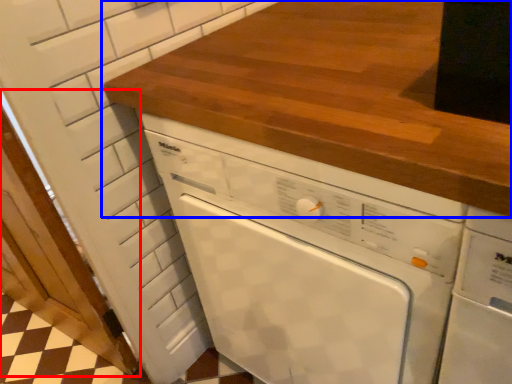
Question: Among these objects, which one is farthest to the camera, door (highlighted by a red box) or countertop (highlighted by a blue box)?

Choices:
 (A) door
 (B) countertop

Answer: (A)